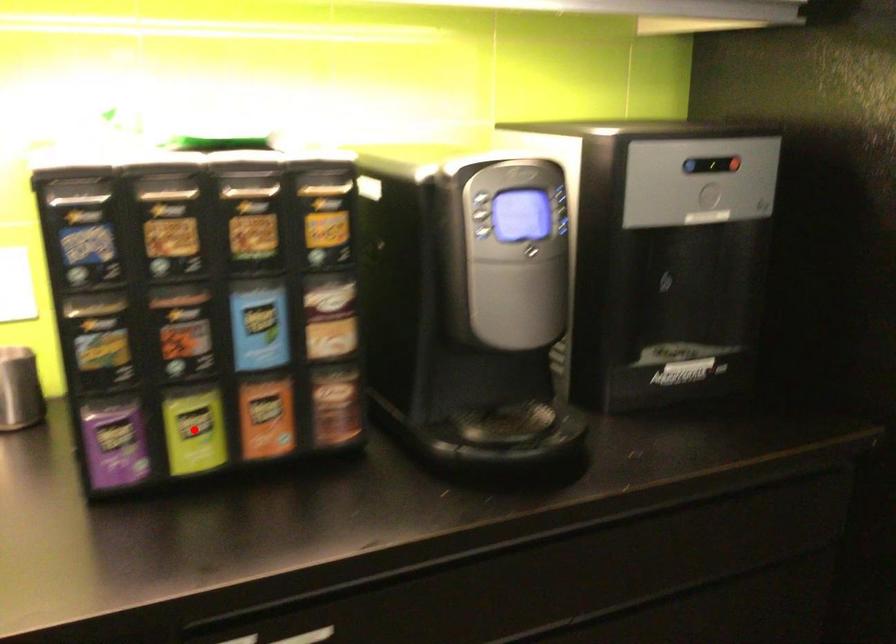
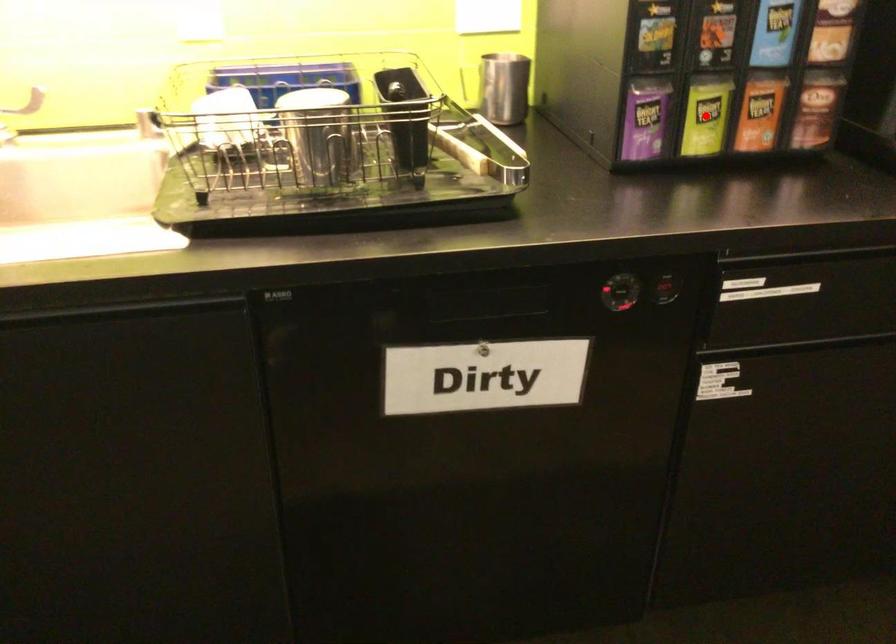
I am providing you with two images of the same scene from different viewpoints. A red point is marked on the first image and another point is marked on the second image. Is the marked point in image1 the same physical position as the marked point in image2?

Yes